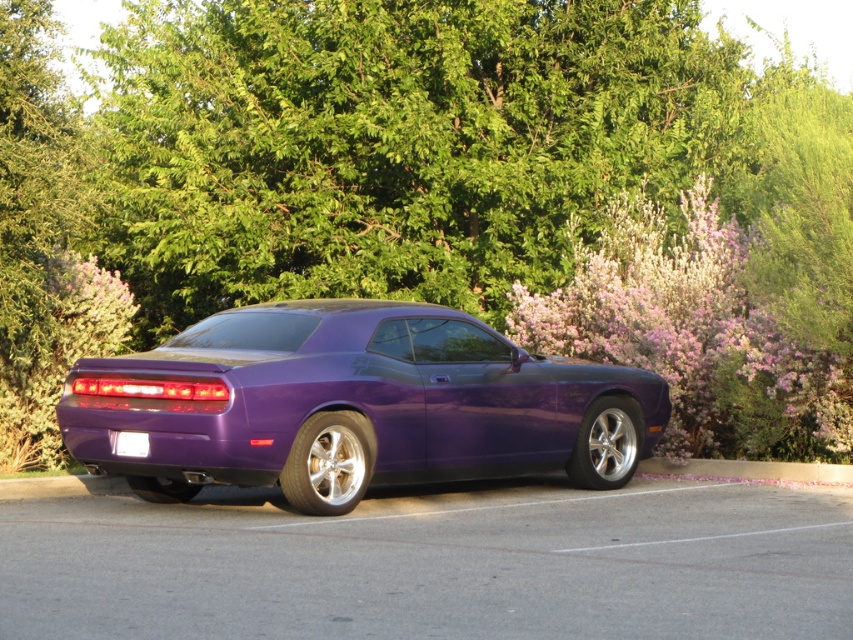
You are a photographer planning to take a photo of the glossy purple car at center and the pink fluffy bush at right. Based on their sizes in the image, which object would you need to move closer to the camera to make them appear the same size in the photo?

The glossy purple car at center is smaller than the pink fluffy bush at right, so you would need to move the glossy purple car at center closer to the camera to make them appear the same size.

You are standing in front of the purple muscle car and want to determine which of the two points, point (428, 314) or point (639, 262), is closer to you. Based on the scene description, which point is nearer?

Point (428, 314) is closer to the viewer than point (639, 262).